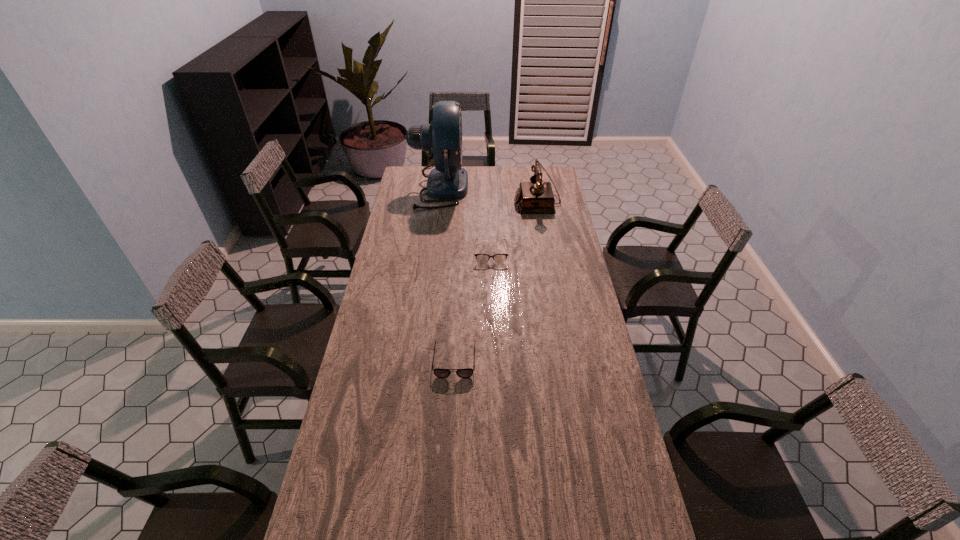
Where is `the tallest object`? This screenshot has height=540, width=960. the tallest object is located at coordinates (442, 138).

Find the location of a particular element. telephone is located at coordinates (535, 197).

The width and height of the screenshot is (960, 540). In order to click on the rightmost object in this screenshot , I will do `click(535, 197)`.

In order to click on the nearest spectacles in this screenshot , I will do `click(468, 372)`.

Find the location of a particular element. the leftmost spectacles is located at coordinates (398, 255).

Where is `free space located in front of the fan to blow air`? This screenshot has height=540, width=960. free space located in front of the fan to blow air is located at coordinates (482, 188).

You are a GUI agent. You are given a task and a screenshot of the screen. Output one action in this format:
    pyautogui.click(x=<x>, y=<y>)
    Task: Click on the free space located on the dial of the telephone
    
    Given the screenshot: What is the action you would take?
    pyautogui.click(x=466, y=202)

Identify the location of free region located 0.050m on the dial of the telephone. (504, 202).

Identify the location of vacant space located on the dial of the telephone. The height and width of the screenshot is (540, 960). (452, 202).

Where is `free spot located 0.400m on the front-facing side of the nearest object`? The image size is (960, 540). free spot located 0.400m on the front-facing side of the nearest object is located at coordinates (447, 499).